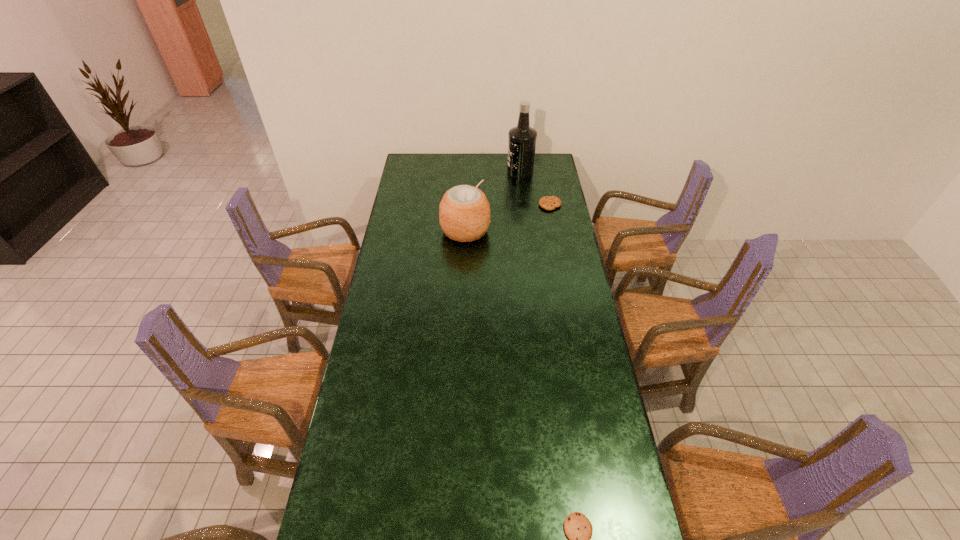
Where is `liquor`? The height and width of the screenshot is (540, 960). liquor is located at coordinates (522, 139).

Identify the location of the tallest object. tap(522, 139).

I want to click on the second nearest object, so click(x=464, y=212).

You are a GUI agent. You are given a task and a screenshot of the screen. Output one action in this format:
    pyautogui.click(x=<x>, y=<y>)
    Task: Click on the coconut
    
    Given the screenshot: What is the action you would take?
    pyautogui.click(x=464, y=212)

Find the location of a particular element. the second farthest object is located at coordinates (547, 202).

This screenshot has height=540, width=960. In order to click on the farther cookie in this screenshot , I will do `click(547, 202)`.

You are a GUI agent. You are given a task and a screenshot of the screen. Output one action in this format:
    pyautogui.click(x=<x>, y=<y>)
    Task: Click on the vacant area situated 0.120m on the front label of the farthest object
    The height and width of the screenshot is (540, 960).
    Given the screenshot: What is the action you would take?
    pyautogui.click(x=486, y=171)

Locate an element on the screen. This screenshot has height=540, width=960. free region located 0.390m on the front label of the farthest object is located at coordinates (437, 171).

Where is `vacant point located 0.160m on the front label of the farthest object`? The height and width of the screenshot is (540, 960). vacant point located 0.160m on the front label of the farthest object is located at coordinates (478, 171).

Locate an element on the screen. vacant point located on the front of the leftmost object is located at coordinates (463, 291).